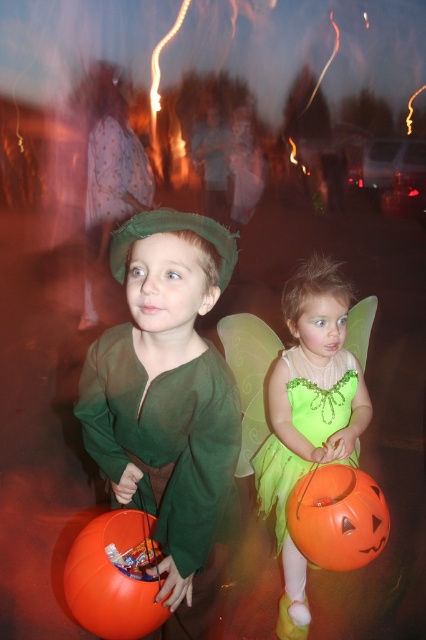
You are a photographer trying to capture the Halloween scene. You notice two points in the image at coordinates point (330, 355) and point (334, 412). Which point is nearer to the camera?

Point (330, 355) is closer to the camera than point (334, 412).

You are standing at the point marked as point (340,410) in the Halloween scene. You want to throw a candy from your position to the child dressed as Peter Pan holding the orange pumpkin bucket. Can you reach them without moving from your spot?

The distance between you and the child dressed as Peter Pan holding the orange pumpkin bucket is 1.96 meters. Since you are at point (340,410), which is 1.96 meters away from the viewer, you can throw the candy to reach them without moving.